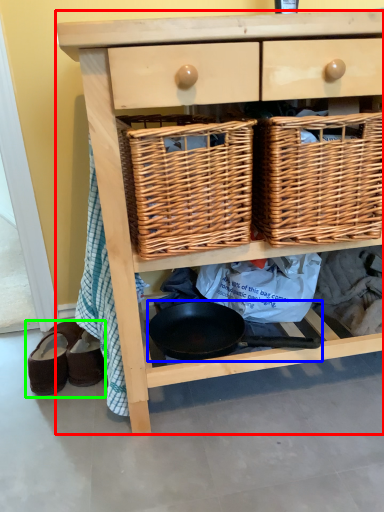
Question: Estimate the real-world distances between objects in this image. Which object is closer to chest of drawers (highlighted by a red box), frying pan (highlighted by a blue box) or footwear (highlighted by a green box)?

Choices:
 (A) frying pan
 (B) footwear

Answer: (A)